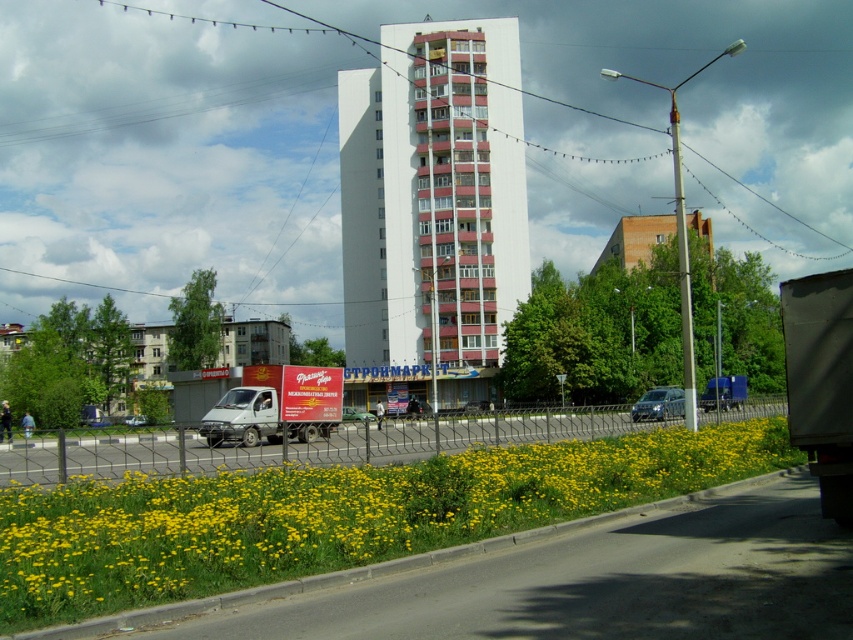
Question: Does green matte truck at center have a smaller size compared to silver metallic van at center?

Choices:
 (A) yes
 (B) no

Answer: (B)

Question: Estimate the real-world distances between objects in this image. Which object is closer to the silver metallic van at center?

Choices:
 (A) green matte truck at center
 (B) white smooth building at center
 (C) white matte truck at center
 (D) blue metallic truck at right

Answer: (A)

Question: Can you confirm if white matte truck at center is positioned below metallic silver van at center?

Choices:
 (A) yes
 (B) no

Answer: (B)

Question: Among these objects, which one is farthest from the camera?

Choices:
 (A) satin silver van at center
 (B) metallic silver van at center
 (C) silver metallic van at center
 (D) blue metallic truck at right

Answer: (B)

Question: Which point is closer to the camera?

Choices:
 (A) metallic silver van at center
 (B) satin silver van at center
 (C) silver metallic van at center
 (D) white smooth building at center

Answer: (B)

Question: Does white smooth building at center have a smaller size compared to blue metallic truck at right?

Choices:
 (A) yes
 (B) no

Answer: (B)